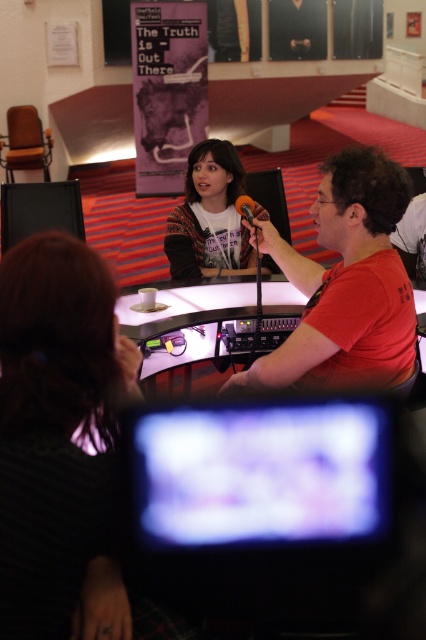
You are a technician adjusting equipment in the studio. You need to place a new stand for the black matte microphone at center so it doesn not block the blurred plastic screen at center. Where should you position the stand relative to the screen?

The blurred plastic screen at center might be wider than the black matte microphone at center. To prevent blocking the screen, position the microphone stand to the side of the screen, ensuring it doesn not overlap with the screen area.